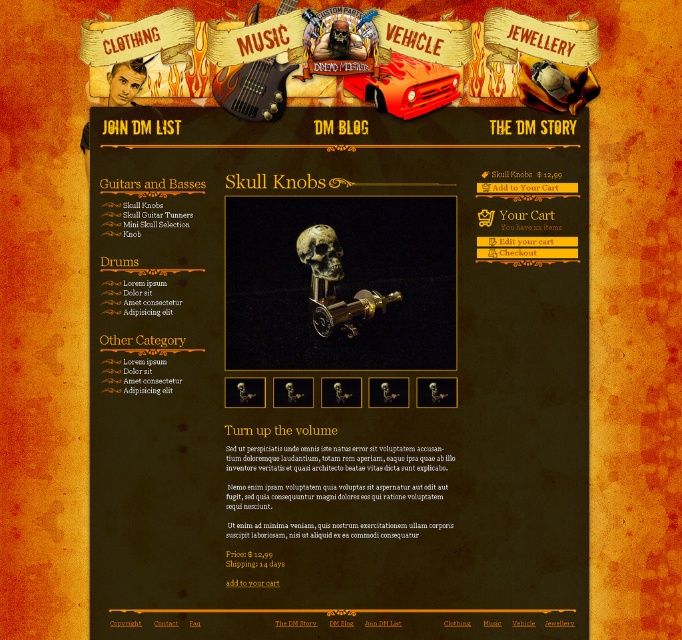
You are a graphic designer adjusting the layout of this webpage. You need to move an element from point A to point B. If point A is at point [404,76] and point B is at point [303,237], will moving the element from point A to point B place it closer to the top of the page?

Point [404,76] is in front of point [303,237], so moving the element from point A to point B will place it closer to the top of the page.

You are designing a webpage layout and need to place the red matte vehicle at center and the gold metallic skull at center next to each other. Which object should be placed first to ensure they fit properly?

The red matte vehicle at center should be placed first because it is wider than the gold metallic skull at center, ensuring there is enough space for both objects.

Consider the image. You are standing in front of a webpage design for a music store. The page has a red matte vehicle at center. If you want to click on the closest object to you on the page, which one should you click?

The red matte vehicle at center is the closest object to you at 4.49 feet away, so you should click on the red matte vehicle at center.